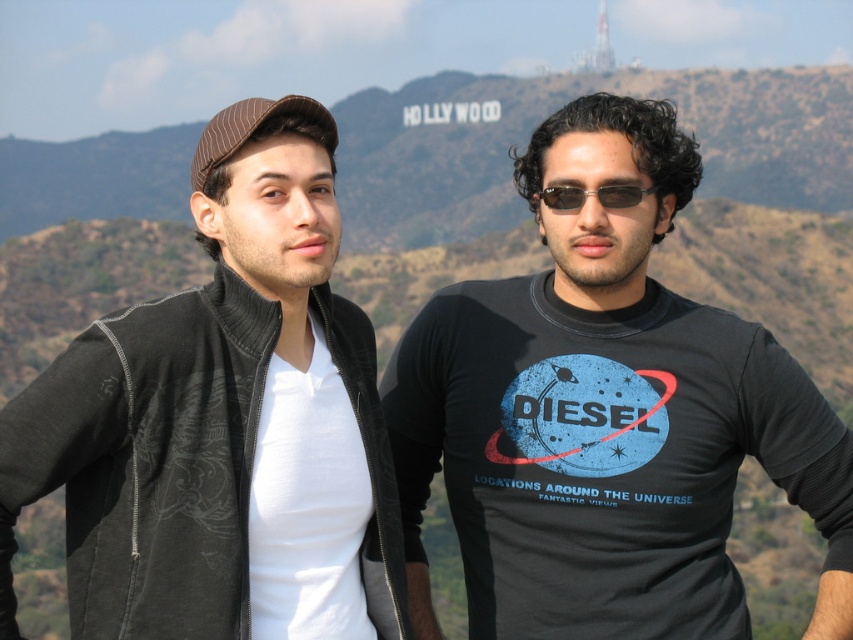
Is matte black jacket at left closer to camera compared to white matte t-shirt at left?

Yes, matte black jacket at left is in front of white matte t-shirt at left.

Find the location of a particular element. This screenshot has height=640, width=853. matte black jacket at left is located at coordinates (223, 422).

Locate an element on the screen. matte black jacket at left is located at coordinates (223, 422).

Measure the distance between black matte t-shirt at center and camera.

black matte t-shirt at center and camera are 217.18 feet apart.

Between point (540, 548) and point (546, 198), which one is positioned behind?

Positioned behind is point (546, 198).

Locate an element on the screen. The height and width of the screenshot is (640, 853). black matte t-shirt at center is located at coordinates (605, 417).

Which of these two, white matte t-shirt at left or sunglasses at center, stands taller?

white matte t-shirt at left is taller.

Is point (339, 504) positioned before point (570, 186)?

Yes, it is in front of point (570, 186).

Identify the location of white matte t-shirt at left. (306, 506).